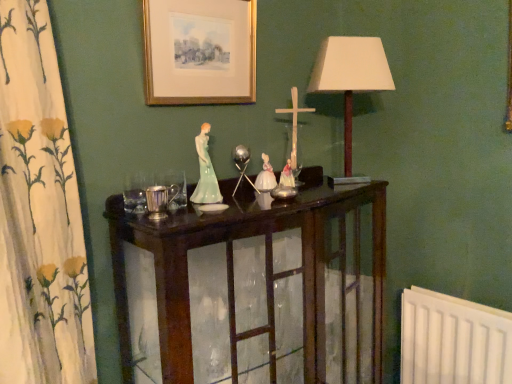
Locate an element on the screen. This screenshot has width=512, height=384. free spot in front of white fabric lampshade at upper right is located at coordinates (336, 190).